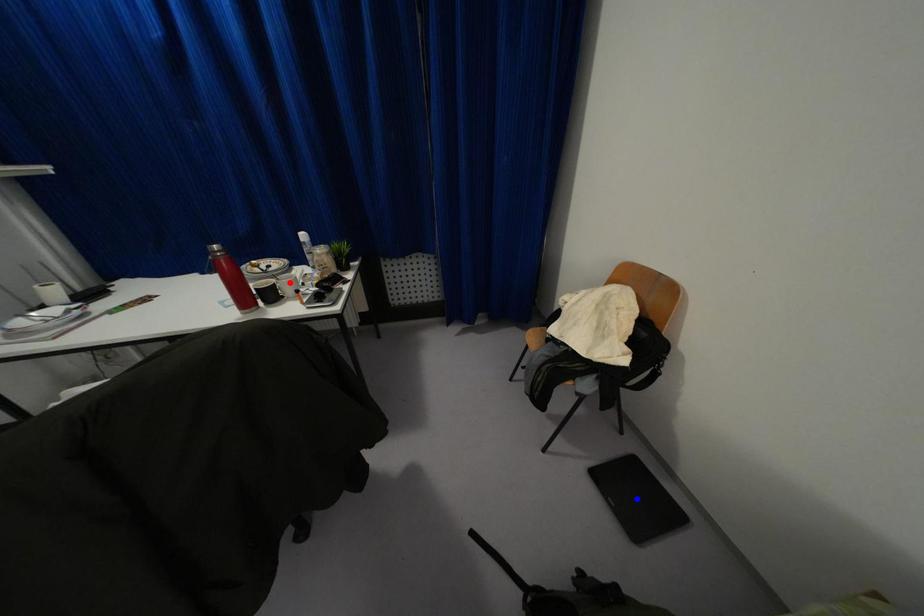
Question: Which of the two points in the image is closer to the camera?

Choices:
 (A) Blue point is closer.
 (B) Red point is closer.

Answer: (A)